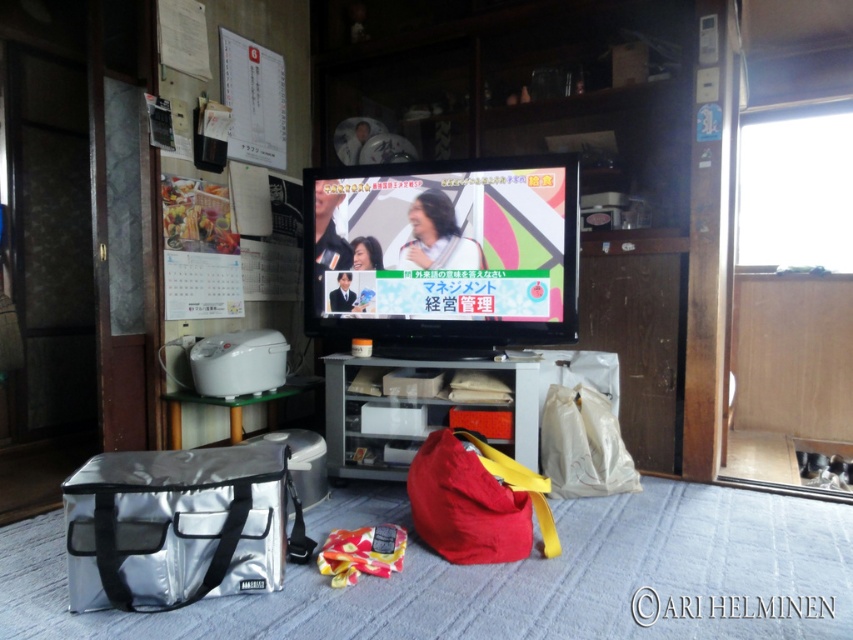
From the picture: You are standing in the living room and want to watch the TV program displayed on the matte plastic tv at center. If you are facing the TV, which direction should you move to get closer to it?

Since the matte plastic tv at center is located at point coordinates, you should move forward towards the center of the room to get closer to the matte plastic tv at center.